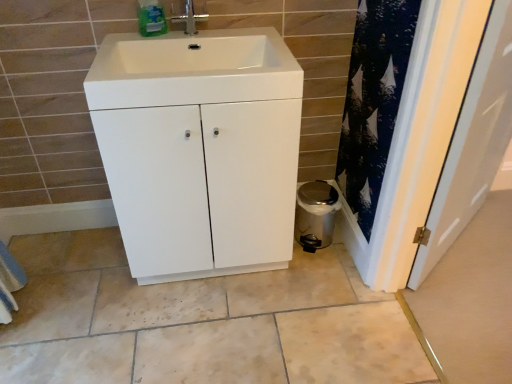
Question: Would you say white matte cabinet at center is to the left or to the right of green plastic bottle at upper center in the picture?

Choices:
 (A) left
 (B) right

Answer: (B)

Question: Choose the correct answer: Is white matte cabinet at center inside green plastic bottle at upper center or outside it?

Choices:
 (A) outside
 (B) inside

Answer: (A)

Question: Which object is positioned farthest from the metallic trash can at lower right?

Choices:
 (A) white glossy sink at center
 (B) silver metallic tap at upper center
 (C) white glossy door at right
 (D) green plastic bottle at upper center
 (E) white matte cabinet at center

Answer: (D)

Question: Which object is the farthest from the green plastic bottle at upper center?

Choices:
 (A) white matte cabinet at center
 (B) white glossy sink at center
 (C) silver metallic tap at upper center
 (D) white glossy door at right
 (E) metallic trash can at lower right

Answer: (D)